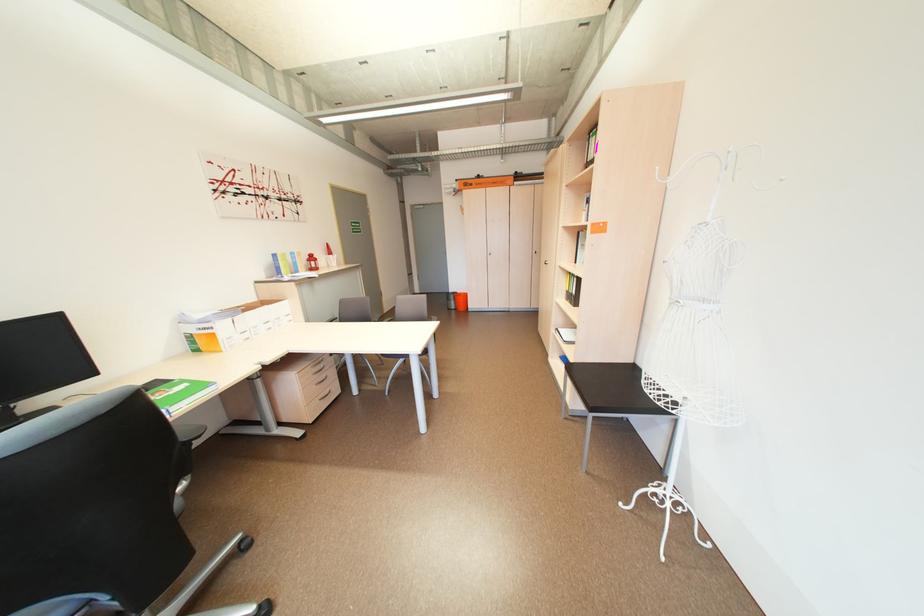
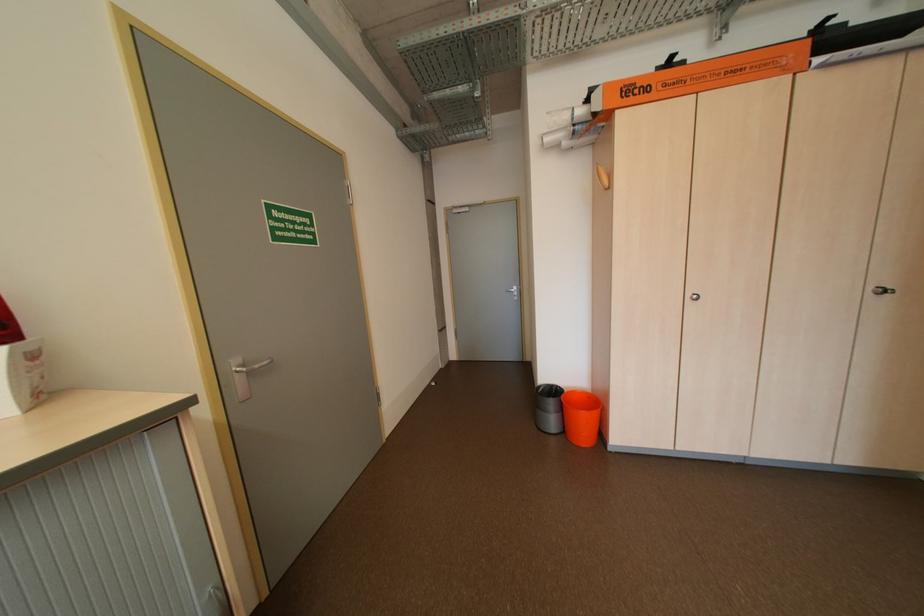
Question: In a continuous first-person perspective shot, in which direction is the camera moving?

Choices:
 (A) Left
 (B) Right
 (C) Forward
 (D) Backward

Answer: (C)